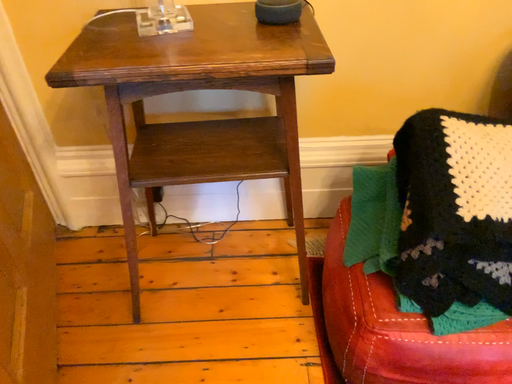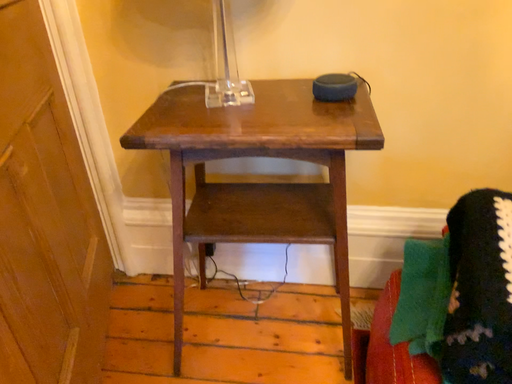
Question: How did the camera likely rotate when shooting the video?

Choices:
 (A) rotated downward
 (B) rotated upward

Answer: (B)